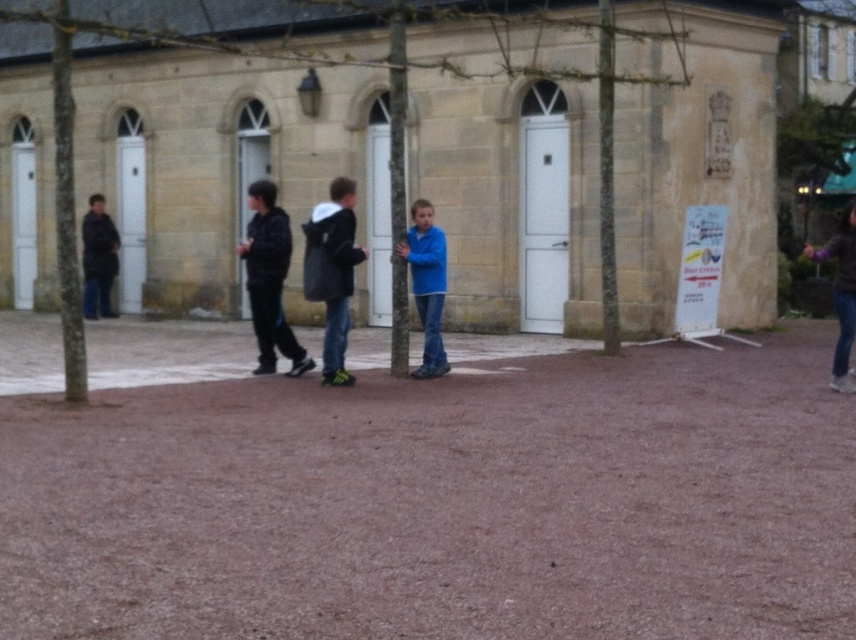
Is black hoodie at center positioned before blue matte jacket at center?

That is False.

Who is positioned more to the left, black hoodie at center or blue matte jacket at center?

black hoodie at center is more to the left.

This screenshot has height=640, width=856. Identify the location of black hoodie at center. 269,280.

Which is in front, point (566, 77) or point (280, 333)?

Point (280, 333)

Which is behind, point (601, 48) or point (272, 317)?

The point (601, 48) is behind.

In order to click on smooth bark tree at center in this screenshot , I will do `click(72, 150)`.

Is blue matte jacket at center further to camera compared to dark brown leather jacket at left?

No, it is not.

Which is behind, point (425, 333) or point (100, 262)?

Point (100, 262)

Locate an element on the screen. blue matte jacket at center is located at coordinates [426, 284].